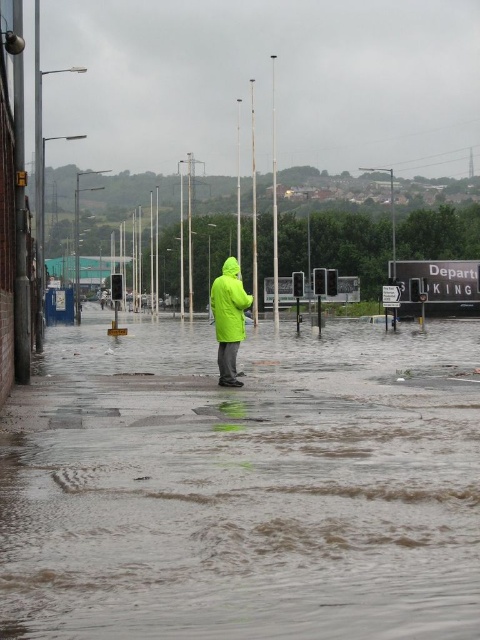
Question: Where is brown muddy water at center located in relation to bright green waterproof jacket at center in the image?

Choices:
 (A) right
 (B) left

Answer: (A)

Question: Can you confirm if brown muddy water at center is positioned below bright green waterproof jacket at center?

Choices:
 (A) no
 (B) yes

Answer: (B)

Question: Among these points, which one is nearest to the camera?

Choices:
 (A) (429, 612)
 (B) (217, 316)

Answer: (A)

Question: Can you confirm if brown muddy water at center is positioned above bright green waterproof jacket at center?

Choices:
 (A) no
 (B) yes

Answer: (A)